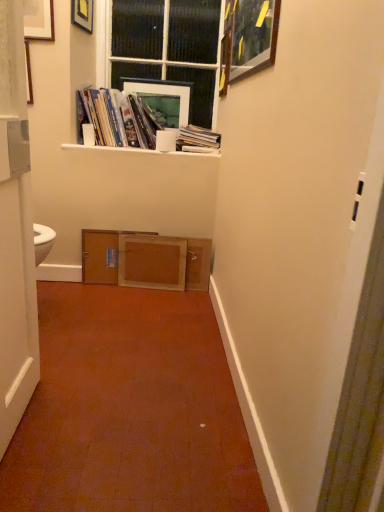
Question: Is matte paper books at upper center, the 2th book when ordered from right to left, facing away from white matte toilet paper at upper center?

Choices:
 (A) yes
 (B) no

Answer: (B)

Question: Could you tell me if matte paper books at upper center, the 2th book when ordered from right to left, is turned towards white matte toilet paper at upper center?

Choices:
 (A) yes
 (B) no

Answer: (A)

Question: Can white matte toilet paper at upper center be found inside matte paper books at upper center, the 2th book when ordered from right to left?

Choices:
 (A) no
 (B) yes

Answer: (B)

Question: Does matte paper books at upper center, the 2th book when ordered from right to left, appear on the right side of white matte toilet paper at upper center?

Choices:
 (A) no
 (B) yes

Answer: (A)

Question: From a real-world perspective, is matte paper books at upper center, the 1th book in the left-to-right sequence, physically above white matte toilet paper at upper center?

Choices:
 (A) yes
 (B) no

Answer: (A)

Question: Is matte paper books at upper center, the 1th book in the left-to-right sequence, beside white matte toilet paper at upper center?

Choices:
 (A) no
 (B) yes

Answer: (A)

Question: Does white matte toilet paper at upper center have a larger size compared to matte black picture frame at upper left, the second picture frame when ordered from front to back?

Choices:
 (A) yes
 (B) no

Answer: (B)

Question: From the image's perspective, does white matte toilet paper at upper center appear lower than matte black picture frame at upper left, the second picture frame when ordered from front to back?

Choices:
 (A) yes
 (B) no

Answer: (A)

Question: Is white matte toilet paper at upper center thinner than matte black picture frame at upper left, which ranks as the 1th picture frame in left-to-right order?

Choices:
 (A) yes
 (B) no

Answer: (B)

Question: Can matte black picture frame at upper left, the 2th picture frame viewed from the back, be found inside white matte toilet paper at upper center?

Choices:
 (A) yes
 (B) no

Answer: (B)

Question: From a real-world perspective, does white matte toilet paper at upper center stand above matte black picture frame at upper left, which ranks as the 1th picture frame in left-to-right order?

Choices:
 (A) no
 (B) yes

Answer: (A)

Question: From a real-world perspective, is white matte toilet paper at upper center positioned under matte black picture frame at upper left, the 2th picture frame viewed from the back, based on gravity?

Choices:
 (A) yes
 (B) no

Answer: (A)

Question: Is white matte toilet paper at upper center far away from wooden picture frame at upper right, the 3th picture frame positioned from the left?

Choices:
 (A) yes
 (B) no

Answer: (B)